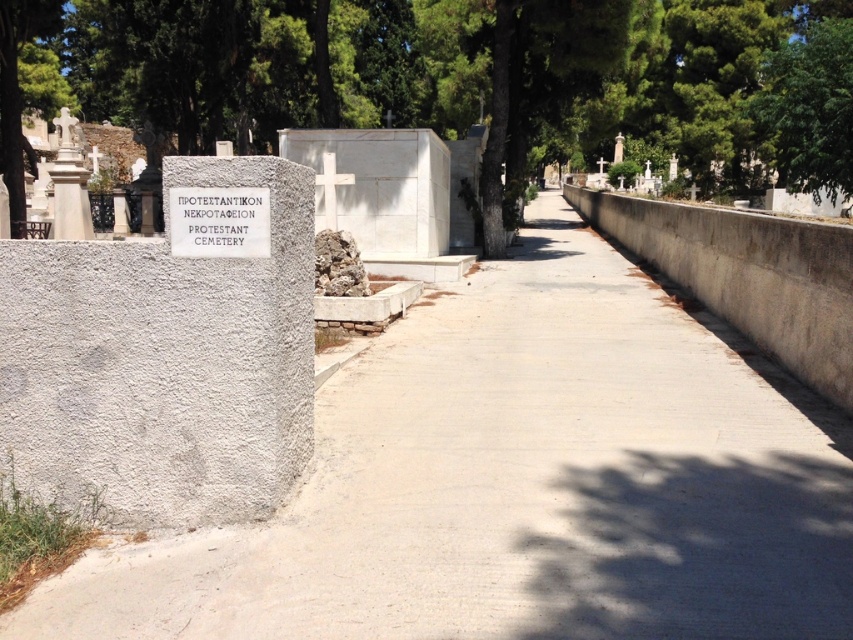
Between green leafy tree at center and green leafy tree at upper right, which one has less height?

green leafy tree at upper right

Who is more forward, (672,136) or (796,116)?

Point (796,116) is in front.

What are the coordinates of `green leafy tree at center` in the screenshot? It's located at (451, 76).

Is green leafy tree at center smaller than white marble statue at upper left?

Incorrect, green leafy tree at center is not smaller in size than white marble statue at upper left.

Between point (0, 148) and point (68, 112), which one is positioned behind?

Positioned behind is point (68, 112).

Where is `green leafy tree at center`? green leafy tree at center is located at coordinates click(451, 76).

The height and width of the screenshot is (640, 853). What are the coordinates of `white marble cross at center` in the screenshot? It's located at (378, 186).

What do you see at coordinates (378, 186) in the screenshot?
I see `white marble cross at center` at bounding box center [378, 186].

What do you see at coordinates (378, 186) in the screenshot? I see `white marble cross at center` at bounding box center [378, 186].

You are a GUI agent. You are given a task and a screenshot of the screen. Output one action in this format:
    pyautogui.click(x=<x>, y=<y>)
    Task: Click on the white marble cross at center
    The image size is (853, 640).
    Given the screenshot: What is the action you would take?
    pyautogui.click(x=378, y=186)